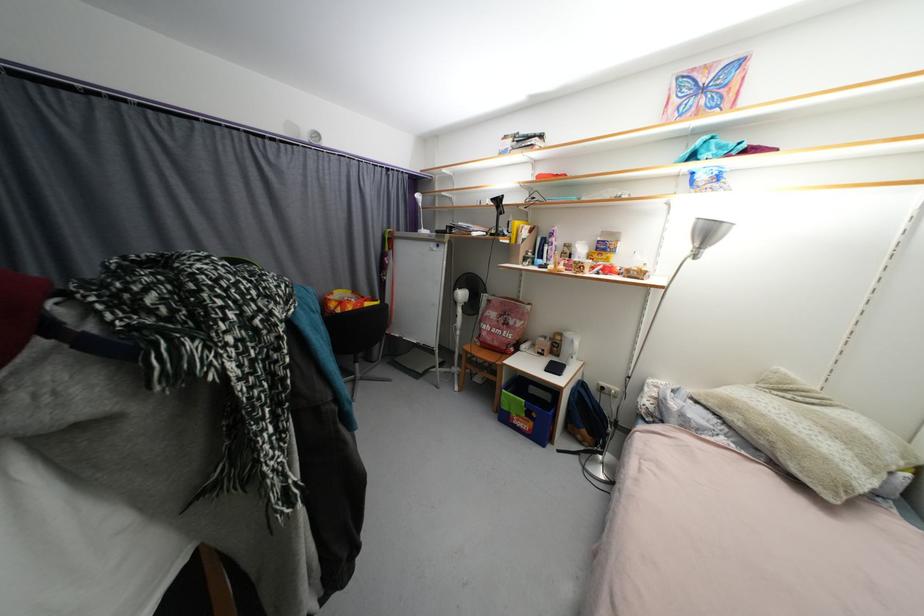
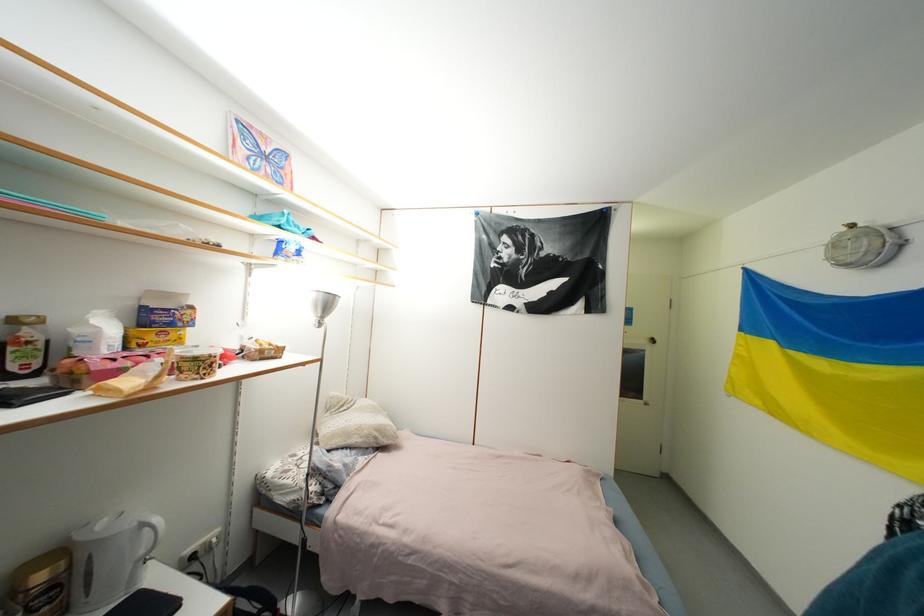
In the second image, find the point that corresponds to pixel 578 342 in the first image.

(149, 528)